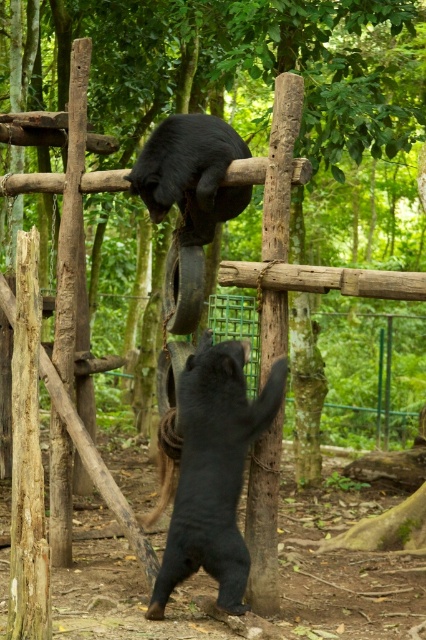
Question: Is shiny black bear at center smaller than brown wood pole at center?

Choices:
 (A) no
 (B) yes

Answer: (A)

Question: Can you confirm if shiny black bear at center is positioned to the left of black matte bear at upper center?

Choices:
 (A) yes
 (B) no

Answer: (B)

Question: Among these objects, which one is nearest to the camera?

Choices:
 (A) shiny black bear at center
 (B) brown wood pole at center

Answer: (A)

Question: Considering the real-world distances, which object is closest to the brown wood pole at center?

Choices:
 (A) black matte bear at upper center
 (B) shiny black bear at center

Answer: (B)

Question: Which object is closer to the camera taking this photo?

Choices:
 (A) black matte bear at upper center
 (B) shiny black bear at center

Answer: (B)

Question: Is shiny black bear at center positioned in front of black matte bear at upper center?

Choices:
 (A) yes
 (B) no

Answer: (A)